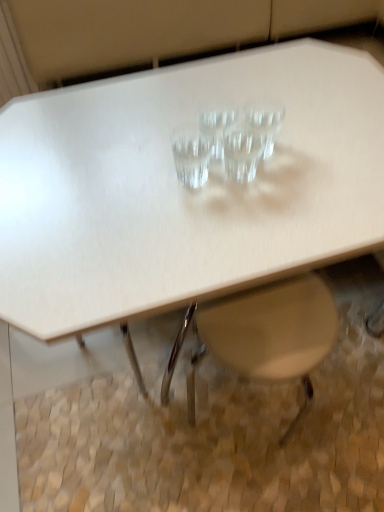
The image size is (384, 512). Identify the location of free location above white plastic swivel chair at lower center (from a real-world perspective). pos(244,332).